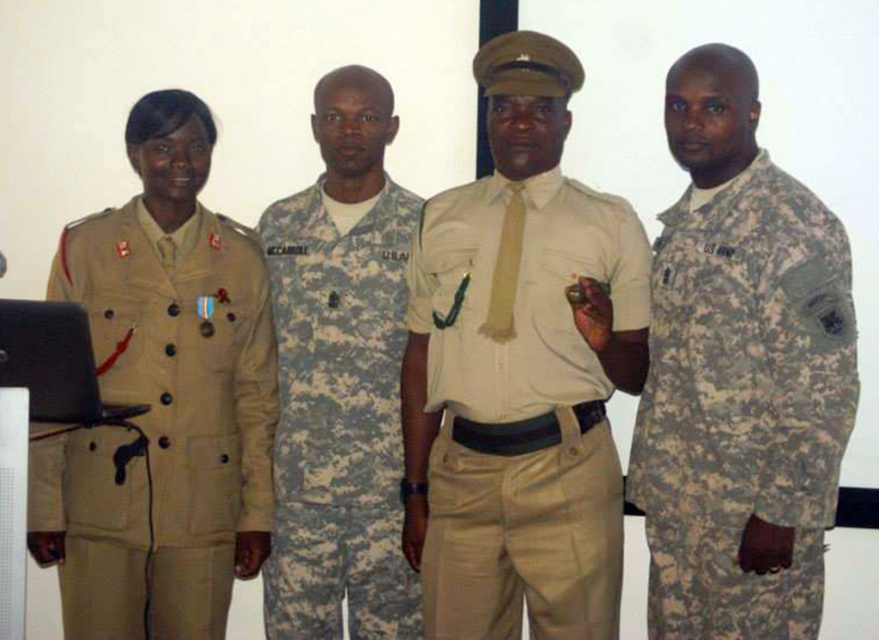
You are a photographer setting up for a group photo. You need to ensure that all subjects fit within the camera frame. The camera frame can only accommodate a total width of 1.8 meters. The tan fabric uniform at left is 0.7 meters wide, and the digital camouflage uniform at center is 0.5 meters wide. Will the two uniforms fit within the camera frame when positioned side by side?

The combined width of the tan fabric uniform at left and the digital camouflage uniform at center is 0.7 meters plus 0.5 meters, totaling 1.2 meters. Since 1.2 meters is less than the camera frame capacity of 1.8 meters, both uniforms will fit within the camera frame.

You are standing at a distance of 7.10 feet from the point marked at coordinates point (554,278). Can you estimate how far you are from this point?

You are exactly 7.10 feet away from the point marked at coordinates point (554,278).

You are a photographer setting up for a group photo. You need to ensure that the beige uniform at center and the camouflage fabric uniform at right are visible in the frame. Based on their positions, which uniform should you focus on first to capture both in the shot?

The beige uniform at center is positioned on the left side of camouflage fabric uniform at right, so focusing on the beige uniform at center first will ensure both uniforms are included in the frame since it is closer to the left edge.